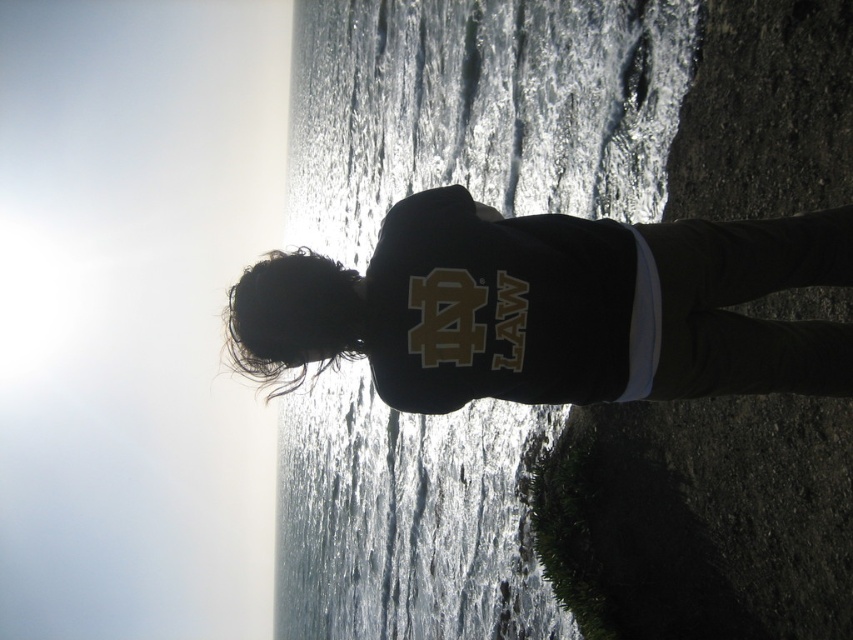
Question: Can you confirm if glistening water at center is thinner than black matte shirt at center?

Choices:
 (A) no
 (B) yes

Answer: (A)

Question: Which object is farther from the camera taking this photo?

Choices:
 (A) black matte shirt at center
 (B) glistening water at center

Answer: (B)

Question: Can you confirm if glistening water at center is bigger than black matte shirt at center?

Choices:
 (A) no
 (B) yes

Answer: (B)

Question: In this image, where is glistening water at center located relative to black matte shirt at center?

Choices:
 (A) below
 (B) above

Answer: (B)

Question: Which of the following is the farthest from the observer?

Choices:
 (A) black matte shirt at center
 (B) glistening water at center

Answer: (B)